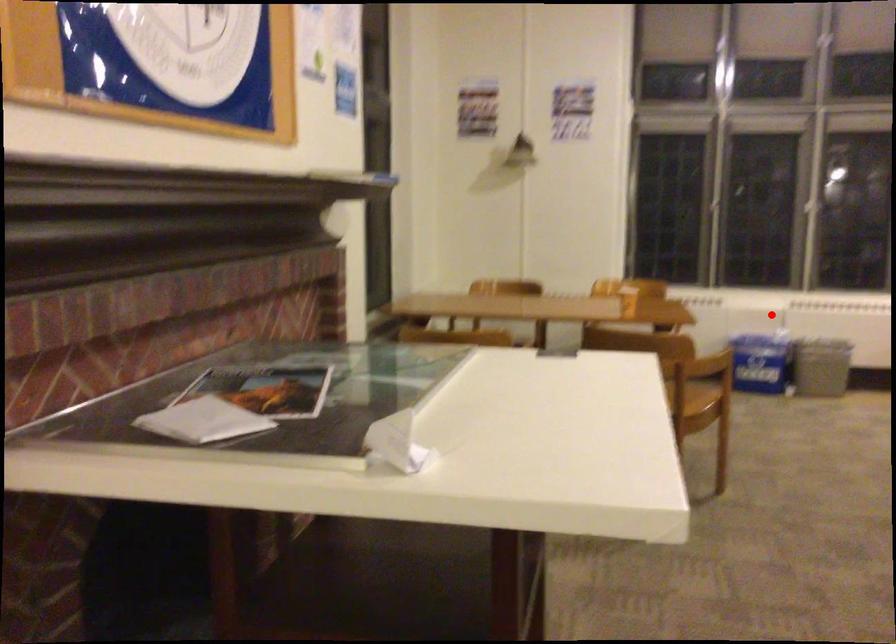
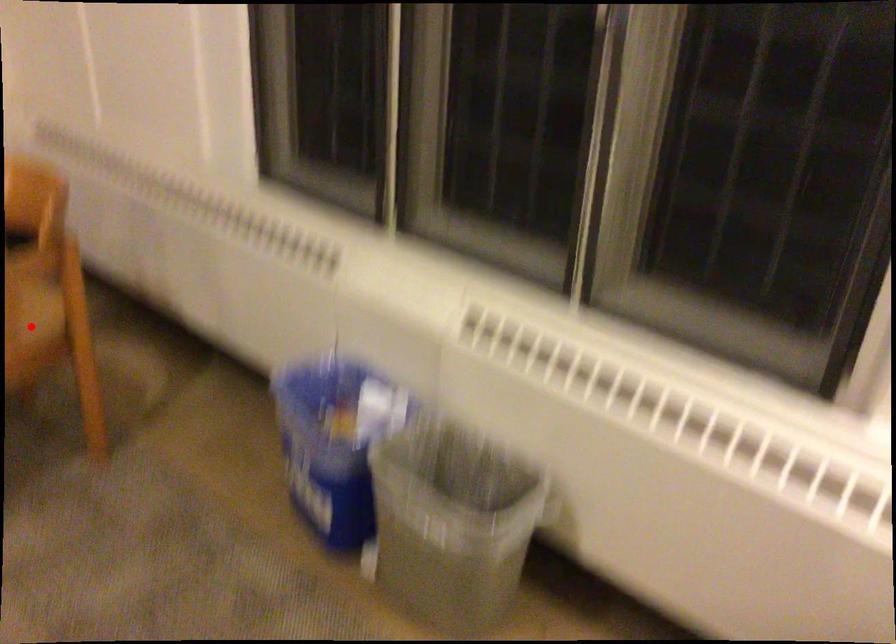
I am providing you with two images of the same scene from different viewpoints. A red point is marked on the first image and another point is marked on the second image. Do the highlighted points in image1 and image2 indicate the same real-world spot?

No